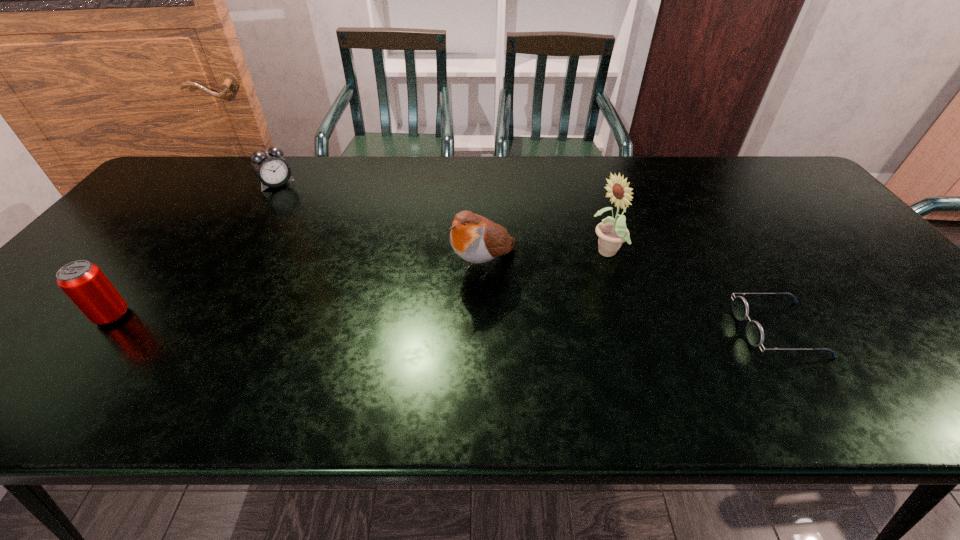
Locate an element on the screen. free space located 0.060m on the right of the can is located at coordinates pyautogui.click(x=155, y=316).

Locate an element on the screen. The height and width of the screenshot is (540, 960). free region located 0.160m on the front-facing side of the rightmost object is located at coordinates (668, 330).

You are a GUI agent. You are given a task and a screenshot of the screen. Output one action in this format:
    pyautogui.click(x=<x>, y=<y>)
    Task: Click on the vacant space situated 0.320m on the front-facing side of the rightmost object
    The height and width of the screenshot is (540, 960).
    Given the screenshot: What is the action you would take?
    pyautogui.click(x=595, y=330)

What are the coordinates of `free space located 0.180m on the front-facing side of the rightmost object` in the screenshot? It's located at (659, 330).

You are a GUI agent. You are given a task and a screenshot of the screen. Output one action in this format:
    pyautogui.click(x=<x>, y=<y>)
    Task: Click on the vacant position located on the front-facing side of the tallest object
    
    Given the screenshot: What is the action you would take?
    pyautogui.click(x=505, y=300)

You are a GUI agent. You are given a task and a screenshot of the screen. Output one action in this format:
    pyautogui.click(x=<x>, y=<y>)
    Task: Click on the vacant space located on the front-facing side of the tallest object
    This screenshot has height=540, width=960.
    Given the screenshot: What is the action you would take?
    pyautogui.click(x=483, y=309)

At what (x,y) coordinates should I click in order to perform the action: click on blank space located on the front-facing side of the tallest object. Please return your answer as a coordinate pair (x, y). Looking at the image, I should click on (523, 292).

The height and width of the screenshot is (540, 960). I want to click on vacant space located 0.260m on the front side of the second object from left to right, so click(323, 231).

Where is `vacant position located 0.360m on the front side of the second object from left to right`? vacant position located 0.360m on the front side of the second object from left to right is located at coordinates (339, 248).

Where is `free spot located on the front side of the second object from left to right`? free spot located on the front side of the second object from left to right is located at coordinates (332, 241).